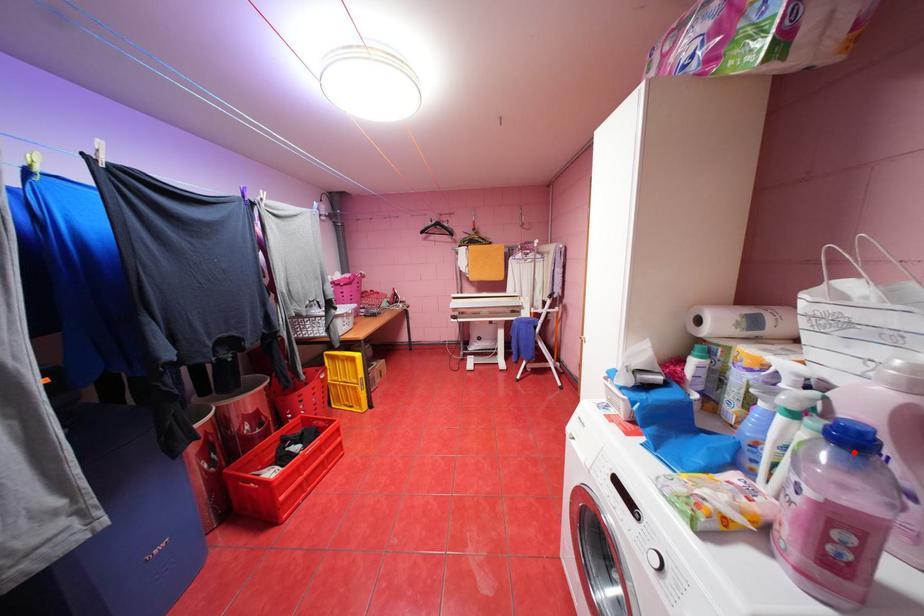
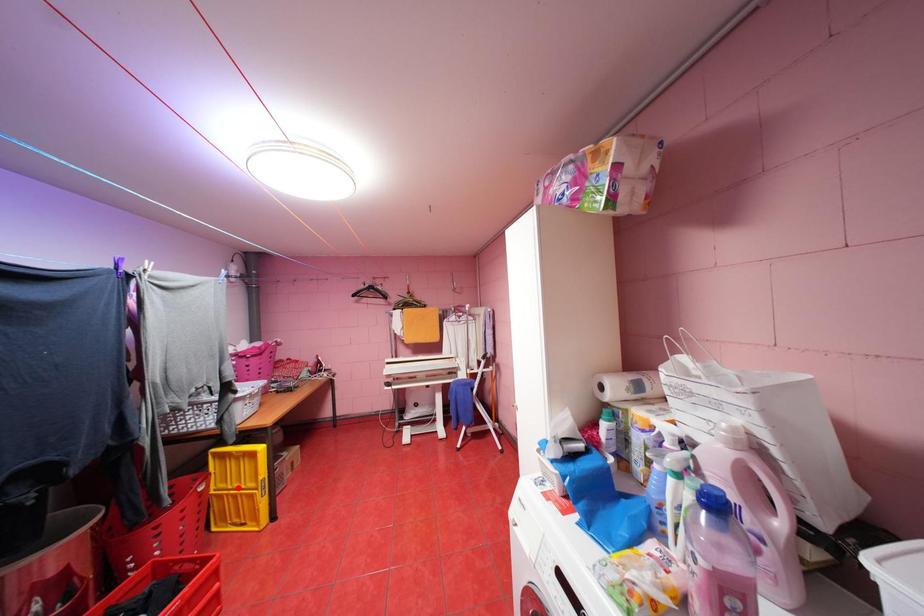
I am providing you with two images of the same scene from different viewpoints. A red point is marked on the first image and another point is marked on the second image. Does the point marked in image1 correspond to the same location as the one in image2?

No